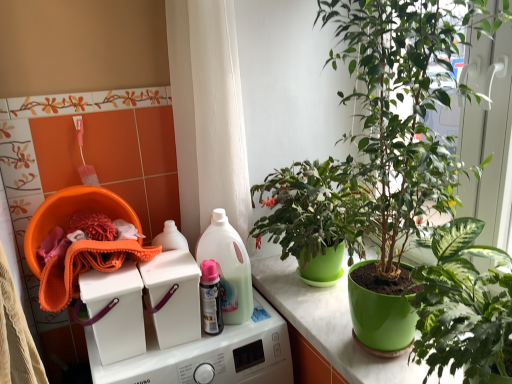
Identify the location of green glossy pot at center, the second houseplant ordered from the bottom. (387, 127).

Where is `orange microfiber cloth at left`? The width and height of the screenshot is (512, 384). orange microfiber cloth at left is located at coordinates (85, 255).

The width and height of the screenshot is (512, 384). I want to click on white plastic washing machine at center, which is the 1th washing machine from bottom to top, so click(207, 355).

Describe the element at coordinates (324, 329) in the screenshot. I see `green glossy pot at center` at that location.

Where is `white plastic washing machine at upper center, which is the 2th washing machine from top to bottom`? The image size is (512, 384). white plastic washing machine at upper center, which is the 2th washing machine from top to bottom is located at coordinates (116, 311).

Does point (344, 27) lie behind point (111, 298)?

No.

Identify the location of the 2nd washing machine below the green glossy pot at center, which ranks as the first houseplant in top-to-bottom order (from the image's perspective). This screenshot has height=384, width=512. click(116, 311).

Can we say green glossy pot at center, the second houseplant ordered from the bottom, lies outside white plastic washing machine at upper center, acting as the 2th washing machine starting from the bottom?

Yes, green glossy pot at center, the second houseplant ordered from the bottom, is located beyond the bounds of white plastic washing machine at upper center, acting as the 2th washing machine starting from the bottom.

Based on the photo, considering the sizes of white plastic washing machine at center, marked as the 1th washing machine in a top-to-bottom arrangement, and translucent plastic bottle at center in the image, is white plastic washing machine at center, marked as the 1th washing machine in a top-to-bottom arrangement, wider or thinner than translucent plastic bottle at center?

In the image, white plastic washing machine at center, marked as the 1th washing machine in a top-to-bottom arrangement, appears to be more narrow than translucent plastic bottle at center.

From a real-world perspective, is white plastic washing machine at center, the 3th washing machine when ordered from bottom to top, on translucent plastic bottle at center?

No.

How many degrees apart are the facing directions of white plastic washing machine at center, the 3th washing machine when ordered from bottom to top, and translucent plastic bottle at center?

There is a 6.64e-05-degree angle between the facing directions of white plastic washing machine at center, the 3th washing machine when ordered from bottom to top, and translucent plastic bottle at center.

Which is in front, point (185, 294) or point (227, 312)?

Point (185, 294)

From the image's perspective, is white plastic washing machine at center, the 3th washing machine when ordered from bottom to top, over white plastic washing machine at center, which is the 1th washing machine from bottom to top?

Correct, white plastic washing machine at center, the 3th washing machine when ordered from bottom to top, appears higher than white plastic washing machine at center, which is the 1th washing machine from bottom to top, in the image.

Can you confirm if white plastic washing machine at center, marked as the 1th washing machine in a top-to-bottom arrangement, is wider than white plastic washing machine at center, which is the third washing machine from top to bottom?

Incorrect, the width of white plastic washing machine at center, marked as the 1th washing machine in a top-to-bottom arrangement, does not surpass that of white plastic washing machine at center, which is the third washing machine from top to bottom.

Is white plastic washing machine at center, the 3th washing machine when ordered from bottom to top, facing towards white plastic washing machine at center, which is the 1th washing machine from bottom to top?

No.

Which object is positioned more to the right, white plastic washing machine at center, marked as the 1th washing machine in a top-to-bottom arrangement, or white plastic washing machine at center, which is the third washing machine from top to bottom?

Positioned to the right is white plastic washing machine at center, which is the third washing machine from top to bottom.

Is green glossy pot at center, the second houseplant ordered from the bottom, at the back of white plastic washing machine at upper center, acting as the 2th washing machine starting from the bottom?

No, white plastic washing machine at upper center, acting as the 2th washing machine starting from the bottom, is not facing the opposite direction of green glossy pot at center, the second houseplant ordered from the bottom.

Is point (117, 315) farther from camera compared to point (412, 37)?

That is True.

Is white plastic washing machine at upper center, acting as the 2th washing machine starting from the bottom, wider than green glossy pot at center, the second houseplant ordered from the bottom?

No.

From the image's perspective, is white plastic washing machine at upper center, which is the 2th washing machine from top to bottom, above or below green glossy pot at center, the second houseplant ordered from the bottom?

white plastic washing machine at upper center, which is the 2th washing machine from top to bottom, is below green glossy pot at center, the second houseplant ordered from the bottom.

Can you confirm if green glossy pot at right, the second houseplant positioned from the top, is taller than translucent plastic bottle at center?

Correct, green glossy pot at right, the second houseplant positioned from the top, is much taller as translucent plastic bottle at center.

Is green glossy pot at right, the second houseplant positioned from the top, not near translucent plastic bottle at center?

No, there isn't a large distance between green glossy pot at right, the second houseplant positioned from the top, and translucent plastic bottle at center.

From the image's perspective, would you say green glossy pot at right, positioned as the first houseplant in bottom-to-top order, is shown under translucent plastic bottle at center?

Yes, from the image's perspective, green glossy pot at right, positioned as the first houseplant in bottom-to-top order, is below translucent plastic bottle at center.

Based on their sizes in the image, would you say green glossy pot at right, positioned as the first houseplant in bottom-to-top order, is bigger or smaller than translucent plastic bottle at center?

green glossy pot at right, positioned as the first houseplant in bottom-to-top order, is bigger than translucent plastic bottle at center.

Is pink glossy spray can at center facing towards translucent plastic bottle at center?

No.

From the image's perspective, is pink glossy spray can at center below translucent plastic bottle at center?

Result: Indeed, from the image's perspective, pink glossy spray can at center is shown beneath translucent plastic bottle at center.

Can you confirm if pink glossy spray can at center is bigger than translucent plastic bottle at center?

Incorrect, pink glossy spray can at center is not larger than translucent plastic bottle at center.

Is green glossy pot at center positioned far away from white plastic washing machine at upper center, which is the 2th washing machine from top to bottom?

No, green glossy pot at center is not far away from white plastic washing machine at upper center, which is the 2th washing machine from top to bottom.

From a real-world perspective, relative to white plastic washing machine at upper center, which is the 2th washing machine from top to bottom, is green glossy pot at center vertically above or below?

green glossy pot at center is below white plastic washing machine at upper center, which is the 2th washing machine from top to bottom.

Which washing machine is the 2nd one when counting from the back of the green glossy pot at center? Please provide its 2D coordinates.

[(116, 311)]

Is green glossy pot at center wider than white plastic washing machine at upper center, acting as the 2th washing machine starting from the bottom?

Yes.

Starting from the white plastic washing machine at upper center, which is the 2th washing machine from top to bottom, which houseplant is the 1st one to the right? Please provide its 2D coordinates.

[(387, 127)]

Where is `cleaning product behind the white plastic washing machine at center, marked as the 1th washing machine in a top-to-bottom arrangement`? cleaning product behind the white plastic washing machine at center, marked as the 1th washing machine in a top-to-bottom arrangement is located at coordinates (228, 267).

Looking at the image, which one is located closer to green glossy pot at center, green glossy pot at center, the second houseplant ordered from the bottom, or orange microfiber cloth at left?

The object closer to green glossy pot at center is green glossy pot at center, the second houseplant ordered from the bottom.

Looking at this image, from the image, which object appears to be farther from translucent plastic bottle at center, green glossy pot at center, the second houseplant ordered from the bottom, or green glossy pot at center?

The object further to translucent plastic bottle at center is green glossy pot at center, the second houseplant ordered from the bottom.

Estimate the real-world distances between objects in this image. Which object is further from translucent plastic bottle at center, orange microfiber cloth at left or green glossy pot at right, positioned as the first houseplant in bottom-to-top order?

Based on the image, green glossy pot at right, positioned as the first houseplant in bottom-to-top order, appears to be further to translucent plastic bottle at center.

Estimate the real-world distances between objects in this image. Which object is closer to translucent plastic bottle at center, white plastic washing machine at center, marked as the 1th washing machine in a top-to-bottom arrangement, or pink glossy spray can at center?

pink glossy spray can at center.

Estimate the real-world distances between objects in this image. Which object is further from green glossy pot at center, which ranks as the first houseplant in top-to-bottom order, green glossy pot at center or white plastic washing machine at center, marked as the 1th washing machine in a top-to-bottom arrangement?

The object further to green glossy pot at center, which ranks as the first houseplant in top-to-bottom order, is white plastic washing machine at center, marked as the 1th washing machine in a top-to-bottom arrangement.

When comparing their distances from green glossy pot at center, does translucent plastic bottle at center or green glossy pot at center, which ranks as the first houseplant in top-to-bottom order, seem closer?

The object closer to green glossy pot at center is translucent plastic bottle at center.

From the image, which object appears to be farther from translucent plastic bottle at center, green glossy pot at right, positioned as the first houseplant in bottom-to-top order, or pink glossy spray can at center?

green glossy pot at right, positioned as the first houseplant in bottom-to-top order, is positioned further to the anchor translucent plastic bottle at center.

From the image, which object appears to be nearer to orange microfiber cloth at left, white plastic washing machine at upper center, acting as the 2th washing machine starting from the bottom, or white plastic washing machine at center, which is the 1th washing machine from bottom to top?

white plastic washing machine at upper center, acting as the 2th washing machine starting from the bottom.

Where is `counter top between white plastic washing machine at upper center, acting as the 2th washing machine starting from the bottom, and green glossy pot at right, positioned as the first houseplant in bottom-to-top order, from left to right`? counter top between white plastic washing machine at upper center, acting as the 2th washing machine starting from the bottom, and green glossy pot at right, positioned as the first houseplant in bottom-to-top order, from left to right is located at coordinates (324, 329).

Find the location of a particular element. cleaning product that lies between orange microfiber cloth at left and white plastic washing machine at center, which is the third washing machine from top to bottom, from top to bottom is located at coordinates (228, 267).

Identify the location of cleaning product between pink glossy spray can at center and green glossy pot at center from left to right. (228, 267).

Locate an element on the screen. cleaning product between orange microfiber cloth at left and green glossy pot at right, the second houseplant positioned from the top, from left to right is located at coordinates (228, 267).